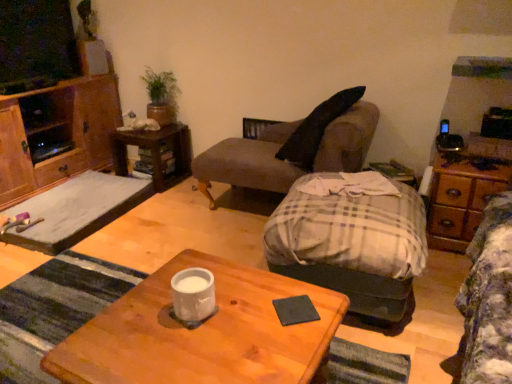
Find the location of a particular element. free region on the left part of black matte coaster at center is located at coordinates (240, 314).